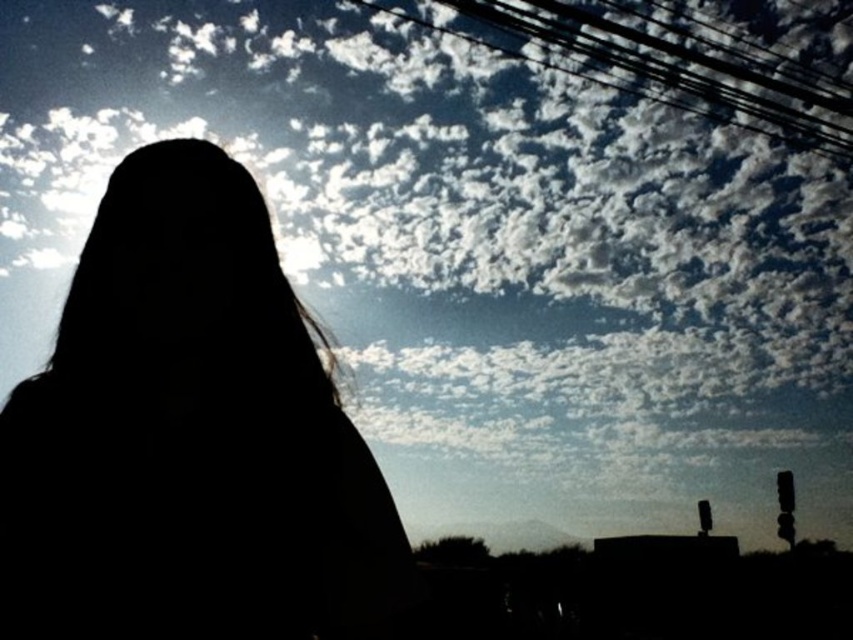
Is black hair at center bigger than black wire at upper center?

Actually, black hair at center might be smaller than black wire at upper center.

Does black hair at center have a smaller size compared to black wire at upper center?

Correct, black hair at center occupies less space than black wire at upper center.

Find the location of a particular element. Image resolution: width=853 pixels, height=640 pixels. black hair at center is located at coordinates (189, 436).